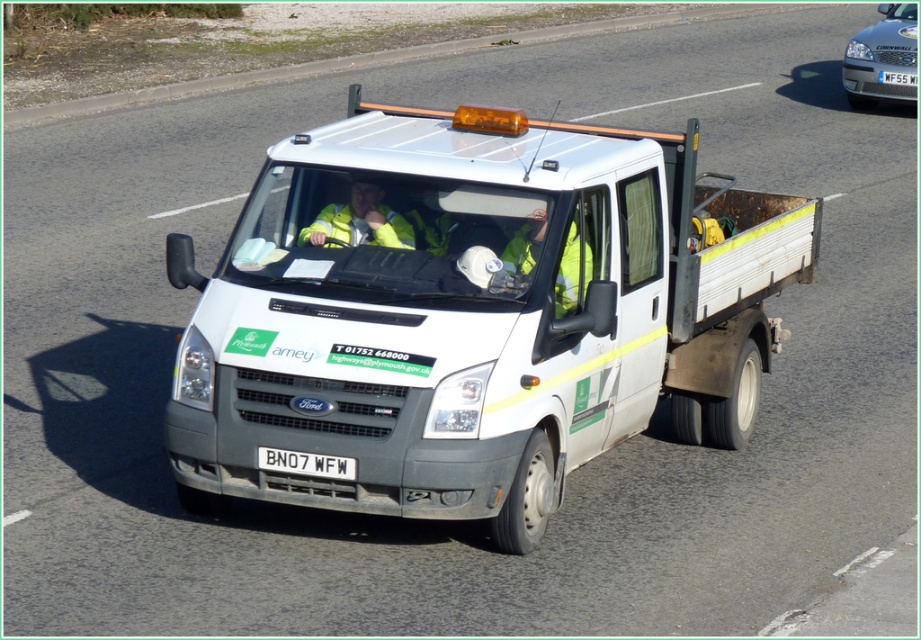
Question: Based on their relative distances, which object is nearer to the white plastic license plate at upper right?

Choices:
 (A) white plastic license plate at center
 (B) white matte truck at center
 (C) silver metallic car at upper right
 (D) yellow reflective vest at center

Answer: (C)

Question: Which is farther from the white plastic license plate at upper right?

Choices:
 (A) white plastic license plate at center
 (B) white matte truck at center
 (C) yellow reflective vest at center

Answer: (A)

Question: Is silver metallic car at upper right positioned before white plastic license plate at center?

Choices:
 (A) no
 (B) yes

Answer: (A)

Question: Is silver metallic car at upper right closer to camera compared to white plastic license plate at center?

Choices:
 (A) no
 (B) yes

Answer: (A)

Question: Can you confirm if white matte truck at center is positioned below yellow reflective vest at center?

Choices:
 (A) yes
 (B) no

Answer: (B)

Question: Which is nearer to the yellow reflective safety vest at center?

Choices:
 (A) silver metallic car at upper right
 (B) white plastic license plate at center
 (C) white plastic license plate at upper right

Answer: (B)